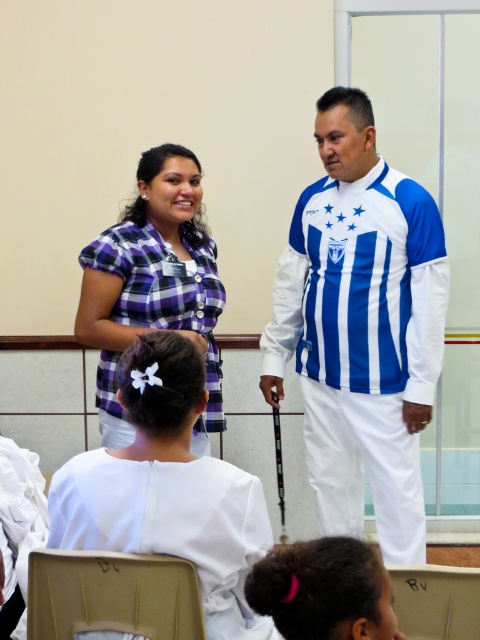
You are attending a meeting and notice two presenters in the front. The white satin blouse at center and the purple checkered shirt at center are both visible. Which presenter is shorter in height?

The white satin blouse at center is not as tall as the purple checkered shirt at center, so the presenter wearing the white satin blouse at center is shorter.

You are a photographer positioned in front of the two individuals. You want to take a photo focusing on the white satin blouse at center and the purple checkered shirt at center. Which one will appear larger in the photo?

The white satin blouse at center will appear larger in the photo because it is closer to the viewer than the purple checkered shirt at center.

Looking at this image, you are organizing a small event and need to decide whether to place a large decorative item on the purple checkered shirt at center or the white plastic chair at lower center. Based on their sizes, which object would be more suitable for placing the item?

The purple checkered shirt at center is larger in size than the white plastic chair at lower center, so it would be more suitable for placing the large decorative item.